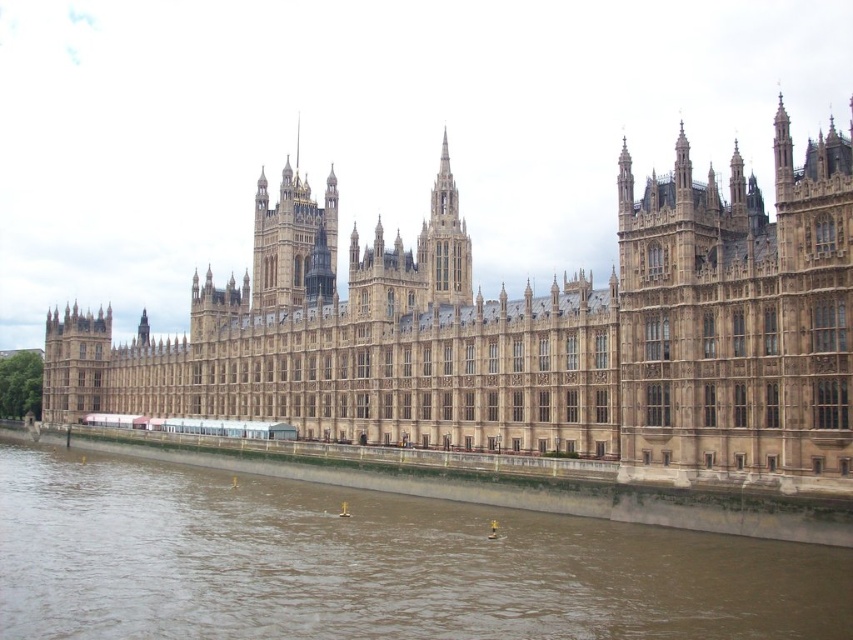
Is point (274, 365) positioned after point (442, 225)?

No, (274, 365) is in front of (442, 225).

Where is `brown stone castle at center`? The width and height of the screenshot is (853, 640). brown stone castle at center is located at coordinates (531, 337).

Is brown stone castle at center thinner than brown sedimentary river at lower left?

No.

Does point (276, 326) lie behind point (148, 612)?

That is True.

The width and height of the screenshot is (853, 640). What are the coordinates of `brown stone castle at center` in the screenshot? It's located at (531, 337).

Is brown sedimentary river at lower left in front of smooth stone spire at center?

Yes.

At what (x,y) coordinates should I click in order to perform the action: click on brown sedimentary river at lower left. Please return your answer as a coordinate pair (x, y). Looking at the image, I should click on (370, 564).